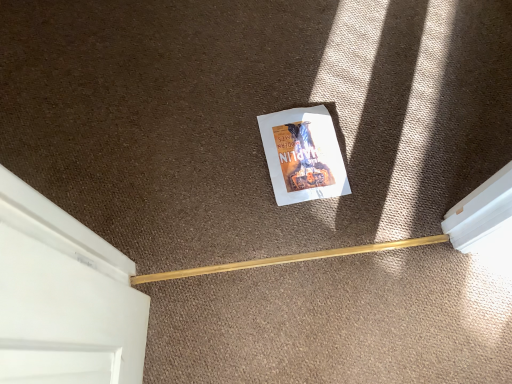
The image size is (512, 384). I want to click on matte paper book at center, so click(x=303, y=155).

What is the approximate height of matte paper book at center?

matte paper book at center is 0.55 inches in height.

What do you see at coordinates (303, 155) in the screenshot?
I see `matte paper book at center` at bounding box center [303, 155].

Where is `matte paper book at center`? matte paper book at center is located at coordinates (303, 155).